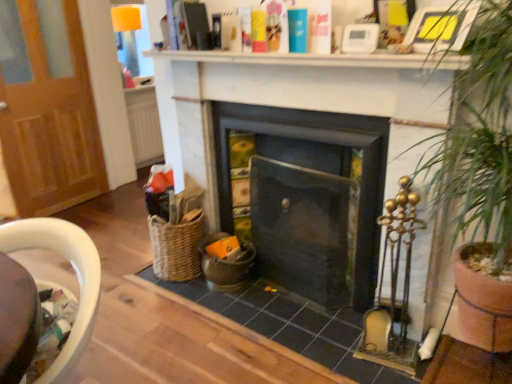
Question: Can you confirm if green leafy plant at right is thinner than woven wicker chair at lower left?

Choices:
 (A) yes
 (B) no

Answer: (B)

Question: Does green leafy plant at right have a greater height compared to woven wicker chair at lower left?

Choices:
 (A) yes
 (B) no

Answer: (A)

Question: From a real-world perspective, is green leafy plant at right positioned over woven wicker chair at lower left based on gravity?

Choices:
 (A) yes
 (B) no

Answer: (A)

Question: Is green leafy plant at right positioned far away from woven wicker chair at lower left?

Choices:
 (A) no
 (B) yes

Answer: (B)

Question: From the image's perspective, is green leafy plant at right above woven wicker chair at lower left?

Choices:
 (A) yes
 (B) no

Answer: (A)

Question: Does green leafy plant at right have a smaller size compared to woven wicker chair at lower left?

Choices:
 (A) no
 (B) yes

Answer: (A)

Question: Would you say wooden door at left is outside dark gray stone fireplace at center, the second fireplace when ordered from left to right?

Choices:
 (A) no
 (B) yes

Answer: (B)

Question: From a real-world perspective, is wooden door at left over dark gray stone fireplace at center, the second fireplace when ordered from left to right?

Choices:
 (A) yes
 (B) no

Answer: (A)

Question: Does wooden door at left have a smaller size compared to dark gray stone fireplace at center, the 1th fireplace in the right-to-left sequence?

Choices:
 (A) yes
 (B) no

Answer: (B)

Question: Is wooden door at left shorter than dark gray stone fireplace at center, the 1th fireplace in the right-to-left sequence?

Choices:
 (A) yes
 (B) no

Answer: (B)

Question: Can you confirm if wooden door at left is positioned to the right of dark gray stone fireplace at center, the second fireplace when ordered from left to right?

Choices:
 (A) no
 (B) yes

Answer: (A)

Question: Is wooden door at left to the left of dark gray stone fireplace at center, the second fireplace when ordered from left to right, from the viewer's perspective?

Choices:
 (A) no
 (B) yes

Answer: (B)

Question: Are woven wicker chair at lower left and dark gray stone fireplace at center, the 1th fireplace in the right-to-left sequence, located far from each other?

Choices:
 (A) no
 (B) yes

Answer: (B)